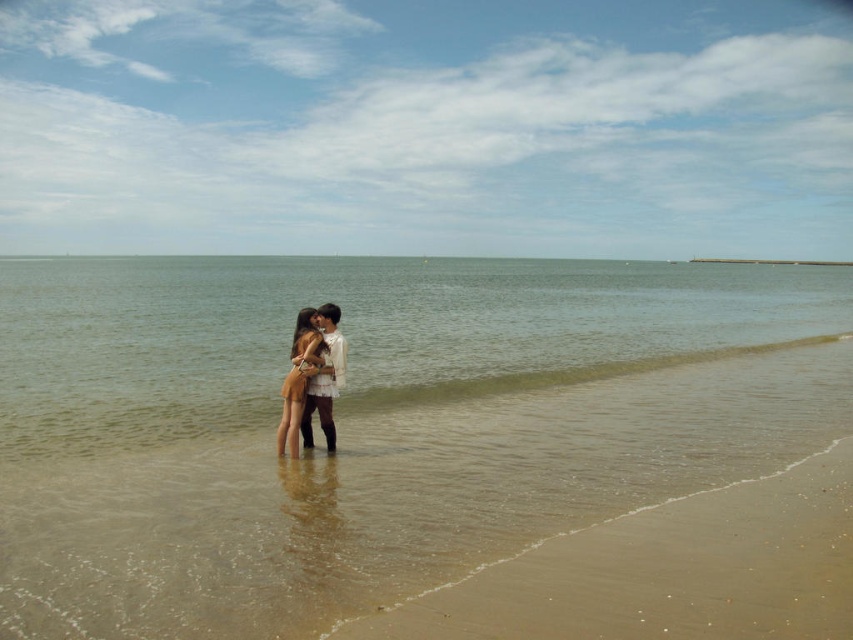
Question: Which of the following is the farthest from the observer?

Choices:
 (A) (183, 497)
 (B) (120, 445)

Answer: (B)

Question: Which object is closer to the camera taking this photo?

Choices:
 (A) matte beige dress at center
 (B) clear water at center

Answer: (A)

Question: Can you confirm if smooth sand beach at center is smaller than clear water at center?

Choices:
 (A) yes
 (B) no

Answer: (A)

Question: Does clear water at center appear under matte beige dress at center?

Choices:
 (A) yes
 (B) no

Answer: (B)

Question: Which of the following is the closest to the observer?

Choices:
 (A) (268, 516)
 (B) (6, 369)

Answer: (A)

Question: Where is clear water at center located in relation to matte beige dress at center in the image?

Choices:
 (A) above
 (B) below

Answer: (A)